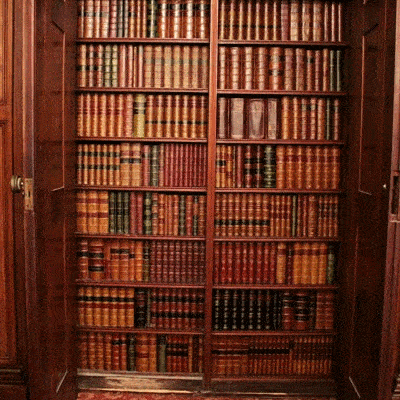
Image resolution: width=400 pixels, height=400 pixels. Identify the location of back of doorknob. (384, 188).